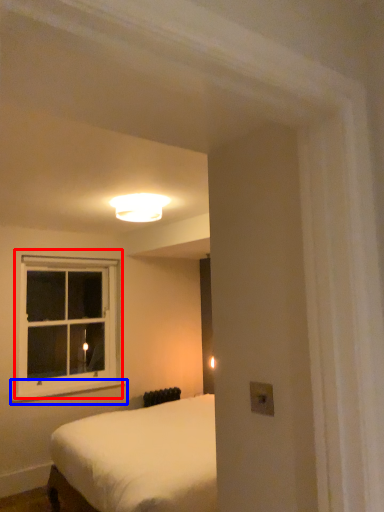
Question: Which object appears farthest to the camera in this image, window (highlighted by a red box) or window sill (highlighted by a blue box)?

Choices:
 (A) window
 (B) window sill

Answer: (A)